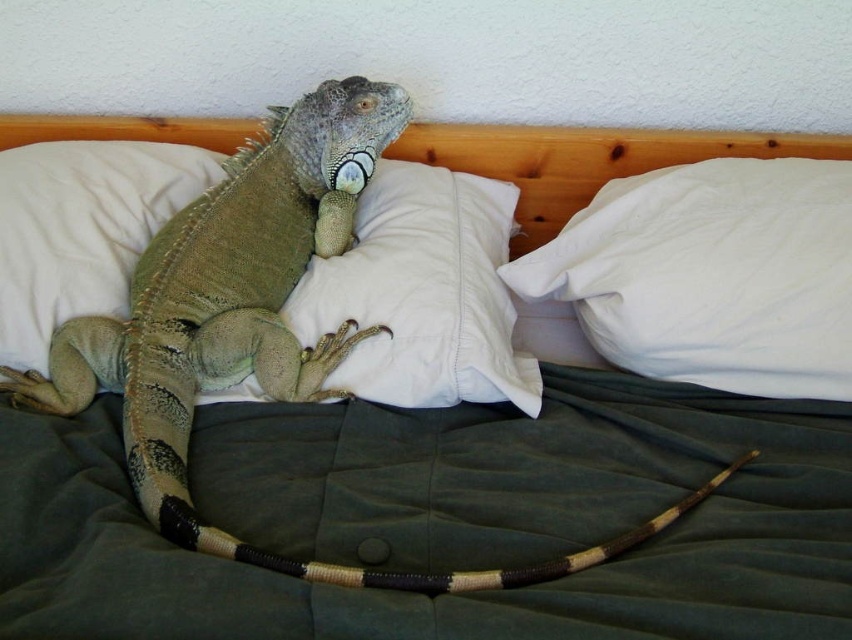
Does white soft pillow at center have a larger size compared to green textured pillow at center?

Yes.

Does white soft pillow at center have a greater width compared to green textured pillow at center?

Correct, the width of white soft pillow at center exceeds that of green textured pillow at center.

Measure the distance between white soft pillow at center and camera.

A distance of 39.09 inches exists between white soft pillow at center and camera.

I want to click on white soft pillow at center, so click(x=423, y=292).

Looking at this image, who is more forward, [728,177] or [432,189]?

Point [728,177] is in front.

Is point (816, 212) positioned after point (343, 259)?

No, it is in front of (343, 259).

This screenshot has width=852, height=640. I want to click on white soft pillow at upper right, so click(711, 275).

Is white soft pillow at upper right taller than green textured pillow at center?

Incorrect, white soft pillow at upper right's height is not larger of green textured pillow at center's.

Does point (551, 285) come farther from viewer compared to point (3, 211)?

Yes, it is.

I want to click on white soft pillow at upper right, so click(x=711, y=275).